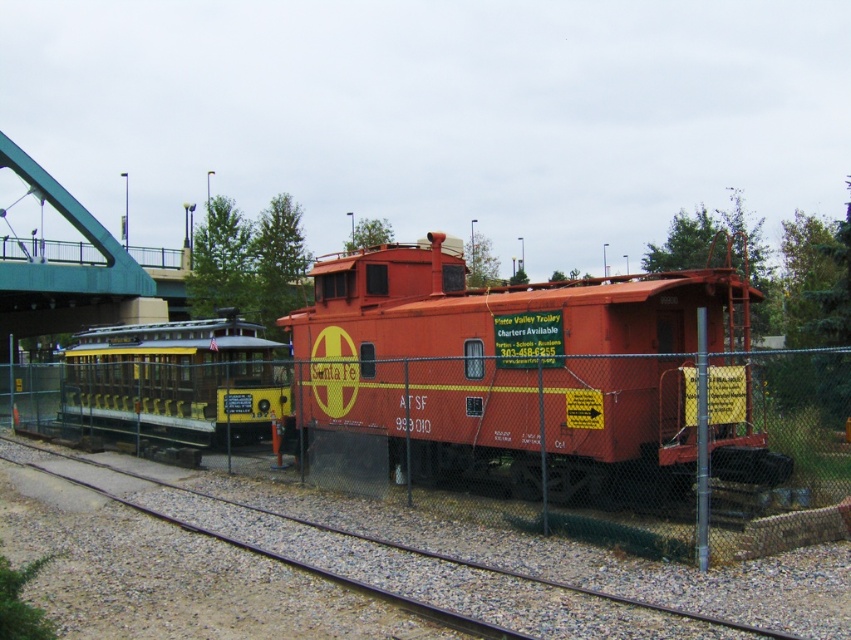
You are standing on the metal train track at lower center and want to walk towards the matte red caboose at center. Which direction should you go?

The metal train track at lower center is behind the matte red caboose at center, so you should walk forward towards the matte red caboose at center to reach it.

From the picture: You are standing in front of the matte red caboose at center and want to take a photo of it. If your camera has a maximum focus range of 30 feet, will it be able to capture the caboose clearly?

The distance between the matte red caboose at center and the camera is 28.95 feet, which is within the camera maximum focus range of 30 feet. Therefore, the camera can capture the caboose clearly.

You are standing at the point marked by coordinates (512, 371) in the scene. What object are you directly at?

The point marked by coordinates (512, 371) is directly at the matte red caboose at center.